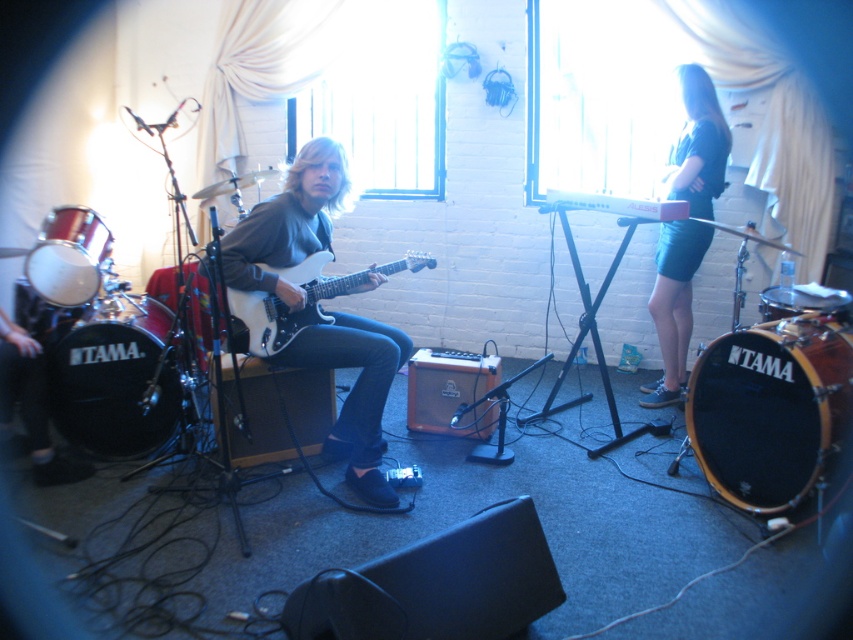
Does point (833, 392) come behind point (125, 408)?

No, it is in front of (125, 408).

Between black wood drum at lower right and black drum at left, which one has more height?

black drum at left is taller.

Describe the element at coordinates (770, 408) in the screenshot. I see `black wood drum at lower right` at that location.

Where is `black wood drum at lower right`? black wood drum at lower right is located at coordinates click(770, 408).

Who is more distant from viewer, (689, 227) or (810, 294)?

The point (689, 227) is behind.

In order to click on dark blue skirt at right in this screenshot , I will do `click(672, 305)`.

Find the location of a particular element. dark blue skirt at right is located at coordinates (672, 305).

Can you confirm if black drum at left is shorter than matte black drum at left?

Incorrect, black drum at left's height does not fall short of matte black drum at left's.

Between black drum at left and matte black drum at left, which one appears on the left side from the viewer's perspective?

Positioned to the left is matte black drum at left.

Image resolution: width=853 pixels, height=640 pixels. Describe the element at coordinates (114, 378) in the screenshot. I see `black drum at left` at that location.

At what (x,y) coordinates should I click in order to perform the action: click on black drum at left. Please return your answer as a coordinate pair (x, y). This screenshot has height=640, width=853. Looking at the image, I should click on (114, 378).